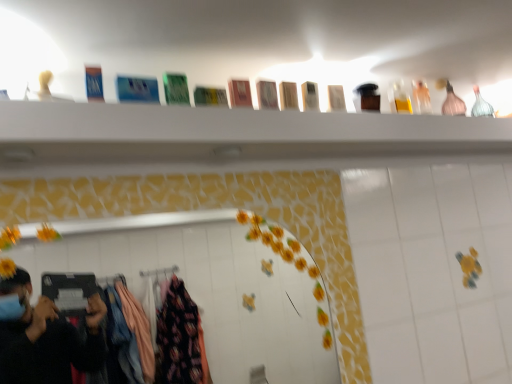
Question: Should I look upward or downward to see white glossy mirror at center?

Choices:
 (A) down
 (B) up

Answer: (A)

Question: Is pink glass bottle at upper right beside white glossy mirror at center?

Choices:
 (A) yes
 (B) no

Answer: (B)

Question: Considering the relative sizes of pink glass bottle at upper right and white glossy mirror at center in the image provided, is pink glass bottle at upper right wider than white glossy mirror at center?

Choices:
 (A) no
 (B) yes

Answer: (B)

Question: Is pink glass bottle at upper right turned away from white glossy mirror at center?

Choices:
 (A) no
 (B) yes

Answer: (A)

Question: Is pink glass bottle at upper right shorter than white glossy mirror at center?

Choices:
 (A) yes
 (B) no

Answer: (A)

Question: Considering the relative positions of pink glass bottle at upper right and white glossy mirror at center in the image provided, is pink glass bottle at upper right to the right of white glossy mirror at center from the viewer's perspective?

Choices:
 (A) yes
 (B) no

Answer: (A)

Question: Considering the relative sizes of pink glass bottle at upper right and white glossy mirror at center in the image provided, is pink glass bottle at upper right taller than white glossy mirror at center?

Choices:
 (A) no
 (B) yes

Answer: (A)

Question: Considering the relative positions of wooden boxes at upper center and white glossy mirror at center in the image provided, is wooden boxes at upper center to the right of white glossy mirror at center from the viewer's perspective?

Choices:
 (A) yes
 (B) no

Answer: (A)

Question: Is wooden boxes at upper center at the left side of white glossy mirror at center?

Choices:
 (A) no
 (B) yes

Answer: (A)

Question: Is the depth of wooden boxes at upper center less than that of white glossy mirror at center?

Choices:
 (A) yes
 (B) no

Answer: (A)

Question: From the image's perspective, would you say wooden boxes at upper center is positioned over white glossy mirror at center?

Choices:
 (A) yes
 (B) no

Answer: (A)

Question: Considering the relative sizes of wooden boxes at upper center and white glossy mirror at center in the image provided, is wooden boxes at upper center bigger than white glossy mirror at center?

Choices:
 (A) no
 (B) yes

Answer: (B)

Question: Is wooden boxes at upper center beside white glossy mirror at center?

Choices:
 (A) no
 (B) yes

Answer: (A)

Question: Is white glossy mirror at center shorter than pink glass bottle at upper right?

Choices:
 (A) no
 (B) yes

Answer: (A)